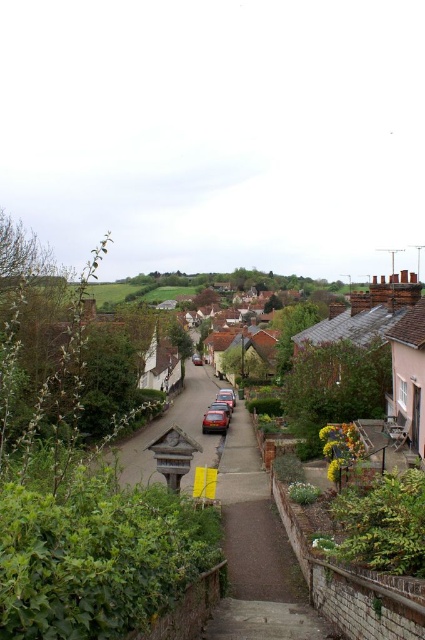
Is shiny metallic car at center further to camera compared to metallic red car at center?

No, shiny metallic car at center is closer to the viewer.

From the picture: Is shiny metallic car at center above metallic red car at center?

No, shiny metallic car at center is not above metallic red car at center.

Where is `shiny metallic car at center`? This screenshot has width=425, height=640. shiny metallic car at center is located at coordinates (218, 416).